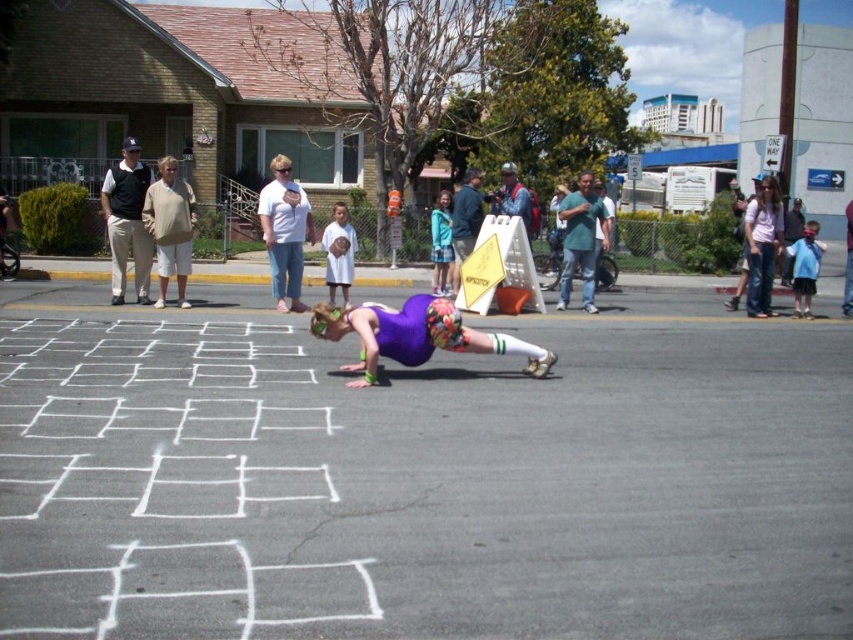
Between black asphalt at center and matte khaki pants at left, which one appears on the left side from the viewer's perspective?

Positioned to the left is matte khaki pants at left.

Who is shorter, black asphalt at center or matte khaki pants at left?

Standing shorter between the two is matte khaki pants at left.

Does point (328, 602) lie in front of point (134, 280)?

Yes, point (328, 602) is closer to viewer.

At what (x,y) coordinates should I click in order to perform the action: click on black asphalt at center. Please return your answer as a coordinate pair (x, y). Image resolution: width=853 pixels, height=640 pixels. Looking at the image, I should click on (419, 483).

Can you confirm if matte khaki pants at left is taller than white cotton shirt at center?

No.

Is matte khaki pants at left behind white cotton shirt at center?

Yes, matte khaki pants at left is further from the viewer.

Where is `matte khaki pants at left`? matte khaki pants at left is located at coordinates (126, 220).

Is pink fabric shirt at upper right positioned at the back of white cotton dress at center?

No.

Between point (776, 216) and point (350, 243), which one is positioned in front?

Positioned in front is point (350, 243).

Is point (759, 216) positioned before point (328, 228)?

No, it is not.

Find the location of a particular element. pink fabric shirt at upper right is located at coordinates (762, 244).